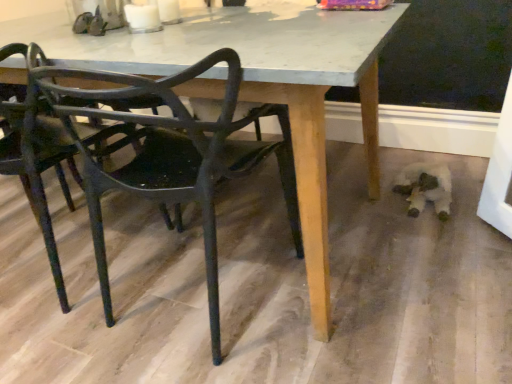
Measure the distance between matte black chair at lower left, marked as the 2th chair in a left-to-right arrangement, and camera.

They are 30.63 inches apart.

The height and width of the screenshot is (384, 512). What are the coordinates of `matte black chair at lower left, which is the first chair from right to left` in the screenshot? It's located at (168, 154).

The height and width of the screenshot is (384, 512). What do you see at coordinates (168, 154) in the screenshot?
I see `matte black chair at lower left, marked as the 2th chair in a left-to-right arrangement` at bounding box center [168, 154].

Locate an element on the screen. metallic black chair at left, which is counted as the second chair, starting from the right is located at coordinates (41, 165).

The height and width of the screenshot is (384, 512). Describe the element at coordinates (41, 165) in the screenshot. I see `metallic black chair at left, which is counted as the second chair, starting from the right` at that location.

What are the coordinates of `matte black chair at lower left, which is the first chair from right to left` in the screenshot? It's located at (168, 154).

Considering the positions of objects matte black chair at lower left, which is the first chair from right to left, and metallic black chair at left, marked as the 1th chair in a left-to-right arrangement, in the image provided, who is more to the left, matte black chair at lower left, which is the first chair from right to left, or metallic black chair at left, marked as the 1th chair in a left-to-right arrangement,?

metallic black chair at left, marked as the 1th chair in a left-to-right arrangement, is more to the left.

Considering the positions of objects matte black chair at lower left, marked as the 2th chair in a left-to-right arrangement, and metallic black chair at left, marked as the 1th chair in a left-to-right arrangement, in the image provided, who is in front, matte black chair at lower left, marked as the 2th chair in a left-to-right arrangement, or metallic black chair at left, marked as the 1th chair in a left-to-right arrangement,?

matte black chair at lower left, marked as the 2th chair in a left-to-right arrangement.

Which is in front, point (178, 215) or point (69, 140)?

The point (69, 140) is in front.

Consider the image. From the image's perspective, is matte black chair at lower left, marked as the 2th chair in a left-to-right arrangement, located beneath metallic black chair at left, which is counted as the second chair, starting from the right?

Yes, from the image's perspective, matte black chair at lower left, marked as the 2th chair in a left-to-right arrangement, is below metallic black chair at left, which is counted as the second chair, starting from the right.

From a real-world perspective, who is located higher, matte black chair at lower left, which is the first chair from right to left, or metallic black chair at left, which is counted as the second chair, starting from the right?

metallic black chair at left, which is counted as the second chair, starting from the right, from a real-world perspective.

Which of these two, matte black chair at lower left, which is the first chair from right to left, or metallic black chair at left, marked as the 1th chair in a left-to-right arrangement, is thinner?

With smaller width is matte black chair at lower left, which is the first chair from right to left.

Which of these two, matte black chair at lower left, which is the first chair from right to left, or metallic black chair at left, which is counted as the second chair, starting from the right, stands shorter?

With less height is metallic black chair at left, which is counted as the second chair, starting from the right.

Is matte black chair at lower left, marked as the 2th chair in a left-to-right arrangement, smaller than metallic black chair at left, which is counted as the second chair, starting from the right?

Indeed, matte black chair at lower left, marked as the 2th chair in a left-to-right arrangement, has a smaller size compared to metallic black chair at left, which is counted as the second chair, starting from the right.

Is matte black chair at lower left, which is the first chair from right to left, not within metallic black chair at left, marked as the 1th chair in a left-to-right arrangement?

Yes, matte black chair at lower left, which is the first chair from right to left, is outside of metallic black chair at left, marked as the 1th chair in a left-to-right arrangement.

Is matte black chair at lower left, which is the first chair from right to left, not close to metallic black chair at left, which is counted as the second chair, starting from the right?

No, matte black chair at lower left, which is the first chair from right to left, is not far away from metallic black chair at left, which is counted as the second chair, starting from the right.

Is matte black chair at lower left, which is the first chair from right to left, turned away from metallic black chair at left, marked as the 1th chair in a left-to-right arrangement?

No.

How far apart are matte black chair at lower left, which is the first chair from right to left, and metallic black chair at left, marked as the 1th chair in a left-to-right arrangement?

matte black chair at lower left, which is the first chair from right to left, is 7.86 inches from metallic black chair at left, marked as the 1th chair in a left-to-right arrangement.

You are a GUI agent. You are given a task and a screenshot of the screen. Output one action in this format:
    pyautogui.click(x=<x>, y=<y>)
    Task: Click on the chair on the right side of metallic black chair at left, marked as the 1th chair in a left-to-right arrangement
    
    Given the screenshot: What is the action you would take?
    pyautogui.click(x=168, y=154)

Which is more to the left, metallic black chair at left, which is counted as the second chair, starting from the right, or matte black chair at lower left, which is the first chair from right to left?

Positioned to the left is metallic black chair at left, which is counted as the second chair, starting from the right.

Considering their positions, is metallic black chair at left, marked as the 1th chair in a left-to-right arrangement, located in front of or behind matte black chair at lower left, marked as the 2th chair in a left-to-right arrangement?

metallic black chair at left, marked as the 1th chair in a left-to-right arrangement, is positioned farther from the viewer than matte black chair at lower left, marked as the 2th chair in a left-to-right arrangement.

From the picture: Which is nearer, (21,152) or (177,148)?

Positioned in front is point (177,148).

From the image's perspective, is metallic black chair at left, which is counted as the second chair, starting from the right, positioned above or below matte black chair at lower left, which is the first chair from right to left?

metallic black chair at left, which is counted as the second chair, starting from the right, is above matte black chair at lower left, which is the first chair from right to left.

From a real-world perspective, which is physically below, metallic black chair at left, marked as the 1th chair in a left-to-right arrangement, or matte black chair at lower left, marked as the 2th chair in a left-to-right arrangement?

In real-world perspective, matte black chair at lower left, marked as the 2th chair in a left-to-right arrangement, is lower.

Which of these two, metallic black chair at left, which is counted as the second chair, starting from the right, or matte black chair at lower left, marked as the 2th chair in a left-to-right arrangement, is wider?

Wider between the two is metallic black chair at left, which is counted as the second chair, starting from the right.

Considering the relative sizes of metallic black chair at left, which is counted as the second chair, starting from the right, and matte black chair at lower left, which is the first chair from right to left, in the image provided, is metallic black chair at left, which is counted as the second chair, starting from the right, shorter than matte black chair at lower left, which is the first chair from right to left,?

Indeed, metallic black chair at left, which is counted as the second chair, starting from the right, has a lesser height compared to matte black chair at lower left, which is the first chair from right to left.

Considering the sizes of objects metallic black chair at left, which is counted as the second chair, starting from the right, and matte black chair at lower left, which is the first chair from right to left, in the image provided, who is smaller, metallic black chair at left, which is counted as the second chair, starting from the right, or matte black chair at lower left, which is the first chair from right to left,?

Smaller between the two is matte black chair at lower left, which is the first chair from right to left.

Is matte black chair at lower left, which is the first chair from right to left, completely or partially inside metallic black chair at left, which is counted as the second chair, starting from the right?

No, matte black chair at lower left, which is the first chair from right to left, is located outside of metallic black chair at left, which is counted as the second chair, starting from the right.

Can you see metallic black chair at left, which is counted as the second chair, starting from the right, touching matte black chair at lower left, which is the first chair from right to left?

No, metallic black chair at left, which is counted as the second chair, starting from the right, is not in contact with matte black chair at lower left, which is the first chair from right to left.

Could you tell me if metallic black chair at left, which is counted as the second chair, starting from the right, is facing matte black chair at lower left, marked as the 2th chair in a left-to-right arrangement?

No, metallic black chair at left, which is counted as the second chair, starting from the right, is not oriented towards matte black chair at lower left, marked as the 2th chair in a left-to-right arrangement.

How different are the orientations of metallic black chair at left, marked as the 1th chair in a left-to-right arrangement, and matte black chair at lower left, marked as the 2th chair in a left-to-right arrangement, in degrees?

The facing directions of metallic black chair at left, marked as the 1th chair in a left-to-right arrangement, and matte black chair at lower left, marked as the 2th chair in a left-to-right arrangement, are 0.00024 degrees apart.

Locate an element on the screen. This screenshot has height=384, width=512. chair in front of the metallic black chair at left, marked as the 1th chair in a left-to-right arrangement is located at coordinates (168, 154).

Image resolution: width=512 pixels, height=384 pixels. Find the location of `chair on the right of metallic black chair at left, which is counted as the second chair, starting from the right`. chair on the right of metallic black chair at left, which is counted as the second chair, starting from the right is located at coordinates (168, 154).

Locate an element on the screen. The image size is (512, 384). chair that is below the metallic black chair at left, marked as the 1th chair in a left-to-right arrangement (from the image's perspective) is located at coordinates (168, 154).